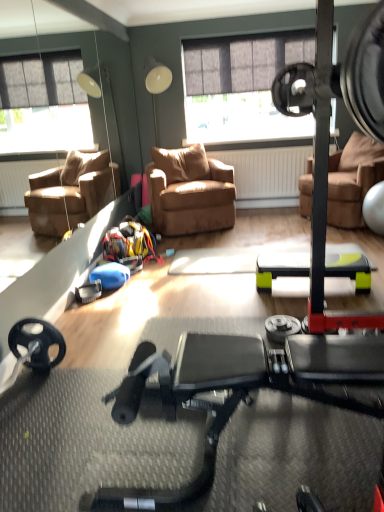
Describe the element at coordinates (240, 392) in the screenshot. I see `black rubber stationary bicycle at center` at that location.

Image resolution: width=384 pixels, height=512 pixels. I want to click on black rubber stationary bicycle at center, so click(240, 392).

At what (x,y) coordinates should I click in order to perform the action: click on brown leather chair at center, the second chair from the left. Please return your answer as a coordinate pair (x, y). The height and width of the screenshot is (512, 384). Looking at the image, I should click on (353, 179).

Image resolution: width=384 pixels, height=512 pixels. I want to click on black rubber stationary bicycle at center, so click(x=240, y=392).

Between brown leather chair at center, the second chair from the left, and brown leather chair at center, the 1th chair positioned from the left, which one appears on the left side from the viewer's perspective?

brown leather chair at center, the 1th chair positioned from the left, is more to the left.

Which of these two, brown leather chair at center, the second chair from the left, or brown leather chair at center, which is counted as the 2th chair, starting from the right, is bigger?

brown leather chair at center, the second chair from the left.

Is brown leather chair at center, which is counted as the 2th chair, starting from the right, next to black rubber stationary bicycle at center and touching it?

No, brown leather chair at center, which is counted as the 2th chair, starting from the right, is not beside black rubber stationary bicycle at center.

From a real-world perspective, is brown leather chair at center, the 1th chair positioned from the left, under black rubber stationary bicycle at center?

Incorrect, from a real-world perspective, brown leather chair at center, the 1th chair positioned from the left, is higher than black rubber stationary bicycle at center.

Is brown leather chair at center, which is counted as the 2th chair, starting from the right, positioned beyond the bounds of black rubber stationary bicycle at center?

brown leather chair at center, which is counted as the 2th chair, starting from the right, is positioned outside black rubber stationary bicycle at center.

From a real-world perspective, is black rubber stationary bicycle at center over brown leather chair at center, the second chair from the left?

No, from a real-world perspective, black rubber stationary bicycle at center is not over brown leather chair at center, the second chair from the left

Locate an element on the screen. stationary bicycle in front of the brown leather chair at center, the second chair from the left is located at coordinates click(x=240, y=392).

In the scene shown: Would you say black rubber stationary bicycle at center is a long distance from brown leather chair at center, the 1th chair in the right-to-left sequence?

That's right, there is a large distance between black rubber stationary bicycle at center and brown leather chair at center, the 1th chair in the right-to-left sequence.

Between black rubber stationary bicycle at center and brown leather chair at center, the second chair from the left, which one has smaller size?

black rubber stationary bicycle at center is smaller.

Which is more to the right, brown leather chair at center, the 1th chair positioned from the left, or brown leather chair at center, the 1th chair in the right-to-left sequence?

brown leather chair at center, the 1th chair in the right-to-left sequence, is more to the right.

Is brown leather chair at center, which is counted as the 2th chair, starting from the right, touching brown leather chair at center, the second chair from the left?

There is a gap between brown leather chair at center, which is counted as the 2th chair, starting from the right, and brown leather chair at center, the second chair from the left.

Based on the photo, from the image's perspective, which is above, brown leather chair at center, the 1th chair positioned from the left, or brown leather chair at center, the 1th chair in the right-to-left sequence?

brown leather chair at center, the 1th chair in the right-to-left sequence, appears higher in the image.

In terms of height, does brown leather chair at center, the 1th chair positioned from the left, look taller or shorter compared to brown leather chair at center, the 1th chair in the right-to-left sequence?

Considering their sizes, brown leather chair at center, the 1th chair positioned from the left, has less height than brown leather chair at center, the 1th chair in the right-to-left sequence.

Is black rubber stationary bicycle at center positioned with its back to brown leather chair at center, the 1th chair positioned from the left?

black rubber stationary bicycle at center is not turned away from brown leather chair at center, the 1th chair positioned from the left.

Which of these two, black rubber stationary bicycle at center or brown leather chair at center, which is counted as the 2th chair, starting from the right, is bigger?

Bigger between the two is brown leather chair at center, which is counted as the 2th chair, starting from the right.

From the picture: Considering the relative positions of black rubber stationary bicycle at center and brown leather chair at center, which is counted as the 2th chair, starting from the right, in the image provided, is black rubber stationary bicycle at center in front of brown leather chair at center, which is counted as the 2th chair, starting from the right,?

Yes.

From a real-world perspective, who is located higher, black rubber stationary bicycle at center or brown leather chair at center, the 1th chair positioned from the left?

brown leather chair at center, the 1th chair positioned from the left.

Considering the relative positions of brown leather chair at center, the 1th chair in the right-to-left sequence, and black rubber stationary bicycle at center in the image provided, is brown leather chair at center, the 1th chair in the right-to-left sequence, behind black rubber stationary bicycle at center?

Yes, the depth of brown leather chair at center, the 1th chair in the right-to-left sequence, is greater than that of black rubber stationary bicycle at center.

Is black rubber stationary bicycle at center completely or partially inside brown leather chair at center, the 1th chair in the right-to-left sequence?

No, black rubber stationary bicycle at center is not inside brown leather chair at center, the 1th chair in the right-to-left sequence.

Between brown leather chair at center, the second chair from the left, and black rubber stationary bicycle at center, which one has less height?

black rubber stationary bicycle at center.

Where is `stationary bicycle on the left of the brown leather chair at center, the 1th chair in the right-to-left sequence`? This screenshot has width=384, height=512. stationary bicycle on the left of the brown leather chair at center, the 1th chair in the right-to-left sequence is located at coordinates (240, 392).

The height and width of the screenshot is (512, 384). Identify the location of chair located above the brown leather chair at center, the 1th chair positioned from the left (from a real-world perspective). (353, 179).

At what (x,y) coordinates should I click in order to perform the action: click on stationary bicycle on the right of brown leather chair at center, which is counted as the 2th chair, starting from the right. Please return your answer as a coordinate pair (x, y). Looking at the image, I should click on (240, 392).

Which object lies nearer to the anchor point brown leather chair at center, the second chair from the left, black rubber stationary bicycle at center or brown leather chair at center, the 1th chair positioned from the left?

brown leather chair at center, the 1th chair positioned from the left, is positioned closer to the anchor brown leather chair at center, the second chair from the left.

From the image, which object appears to be nearer to black rubber stationary bicycle at center, brown leather chair at center, which is counted as the 2th chair, starting from the right, or brown leather chair at center, the 1th chair in the right-to-left sequence?

brown leather chair at center, which is counted as the 2th chair, starting from the right, is positioned closer to the anchor black rubber stationary bicycle at center.

Estimate the real-world distances between objects in this image. Which object is closer to brown leather chair at center, the second chair from the left, brown leather chair at center, the 1th chair positioned from the left, or black rubber stationary bicycle at center?

Among the two, brown leather chair at center, the 1th chair positioned from the left, is located nearer to brown leather chair at center, the second chair from the left.

When comparing their distances from black rubber stationary bicycle at center, does brown leather chair at center, the 1th chair in the right-to-left sequence, or brown leather chair at center, which is counted as the 2th chair, starting from the right, seem further?

brown leather chair at center, the 1th chair in the right-to-left sequence, lies further to black rubber stationary bicycle at center than the other object.

From the picture: Looking at the image, which one is located further to brown leather chair at center, the 1th chair positioned from the left, brown leather chair at center, the 1th chair in the right-to-left sequence, or black rubber stationary bicycle at center?

black rubber stationary bicycle at center is further to brown leather chair at center, the 1th chair positioned from the left.

Which object lies further to the anchor point brown leather chair at center, which is counted as the 2th chair, starting from the right, black rubber stationary bicycle at center or brown leather chair at center, the 1th chair in the right-to-left sequence?

black rubber stationary bicycle at center is further to brown leather chair at center, which is counted as the 2th chair, starting from the right.

Identify the location of chair located between black rubber stationary bicycle at center and brown leather chair at center, the 1th chair positioned from the left, in the depth direction. (353, 179).